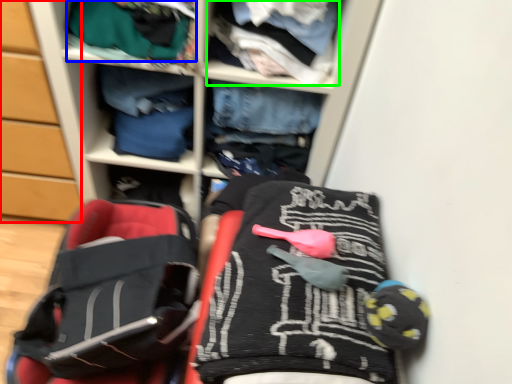
Question: Which object is the farthest from cabinetry (highlighted by a red box)? Choose among these: clothing (highlighted by a blue box) or clothing (highlighted by a green box).

Choices:
 (A) clothing
 (B) clothing

Answer: (B)